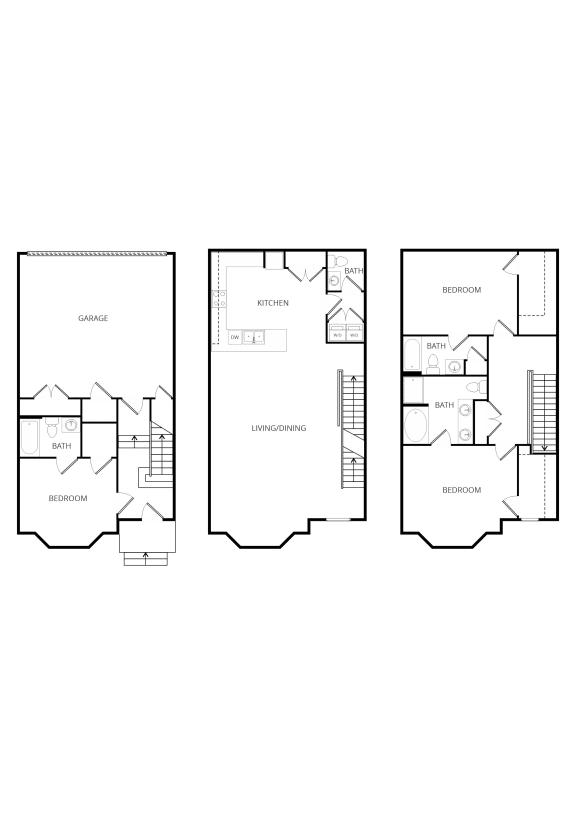
I want to click on rooms, so click(60, 445), click(83, 495), click(285, 302), click(286, 429), click(353, 272), click(352, 330), click(463, 294), click(439, 348), click(450, 407), click(456, 493).